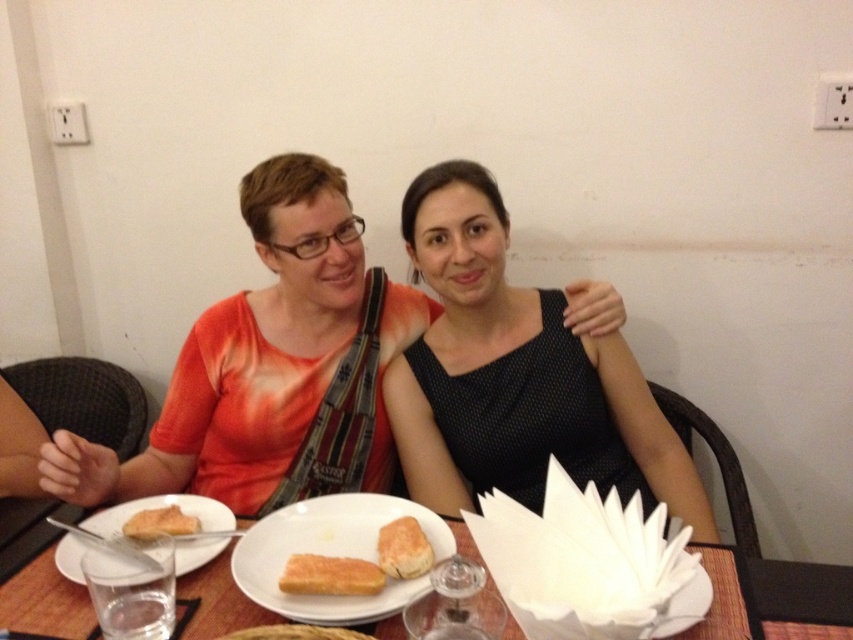
Based on the photo, you are a photographer trying to capture the golden crispy toast at center without including the black dotted dress at center in the frame. Is this possible based on their positions?

The golden crispy toast at center is behind the black dotted dress at center, so it would not be visible in the frame without moving the dress, making it impossible to capture the toast without including the dress.

In the scene shown: You are a photographer trying to capture the black dotted dress at center in the image. What are the coordinates where you should focus your camera?

The black dotted dress at center is located at coordinates point (515, 376), so you should focus your camera there.

You are a waiter at a restaurant and need to place a new dish on the table. The dish must be placed in front of the golden brown bread at center. Where should you place it relative to the white matte plate at center?

The white matte plate at center is already in front of the golden brown bread at center, so the new dish should be placed behind the white matte plate at center to be in front of the bread.